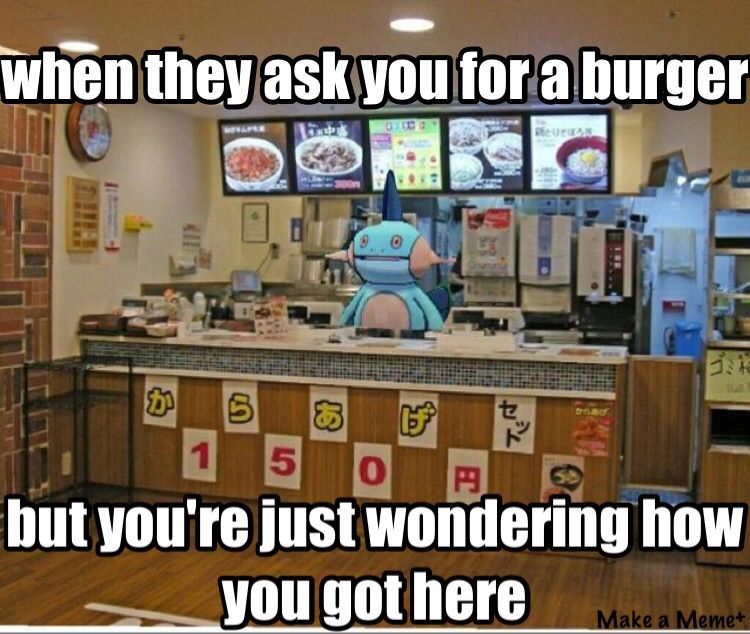
I want to click on drink machines, so click(x=608, y=262), click(x=556, y=253), click(x=484, y=249).